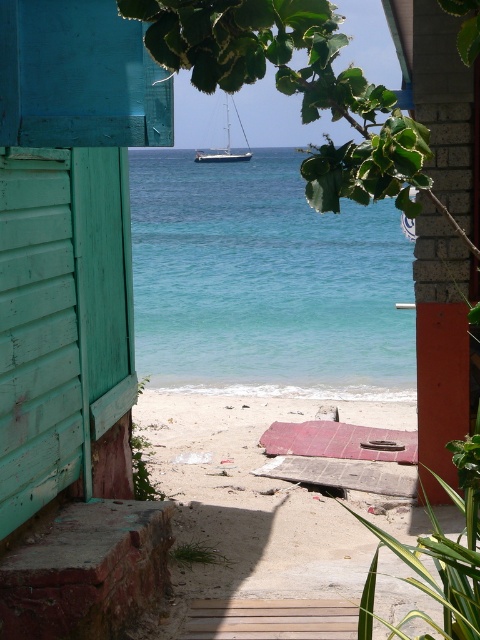
Does wooden boardwalk at lower center have a lesser height compared to teal wood shutter at left?

Correct, wooden boardwalk at lower center is not as tall as teal wood shutter at left.

Is wooden boardwalk at lower center thinner than teal wood shutter at left?

In fact, wooden boardwalk at lower center might be wider than teal wood shutter at left.

Find the location of a particular element. This screenshot has height=640, width=480. wooden boardwalk at lower center is located at coordinates (245, 508).

Is teal wood shutter at left positioned at the back of white glossy sailboat at center?

No, teal wood shutter at left is closer to the viewer.

Find the location of a particular element. teal wood shutter at left is located at coordinates (37, 333).

Find the location of a particular element. This screenshot has height=640, width=480. teal wooden beach hut at left is located at coordinates (72, 321).

What do you see at coordinates (72, 321) in the screenshot? I see `teal wooden beach hut at left` at bounding box center [72, 321].

Describe the element at coordinates (72, 321) in the screenshot. I see `teal wooden beach hut at left` at that location.

This screenshot has height=640, width=480. Identify the location of teal wooden beach hut at left. tap(72, 321).